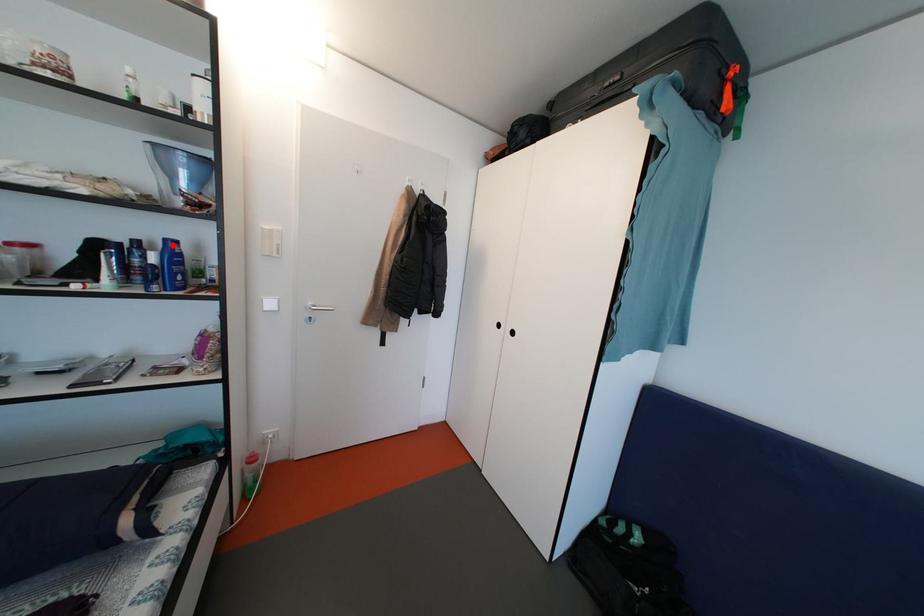
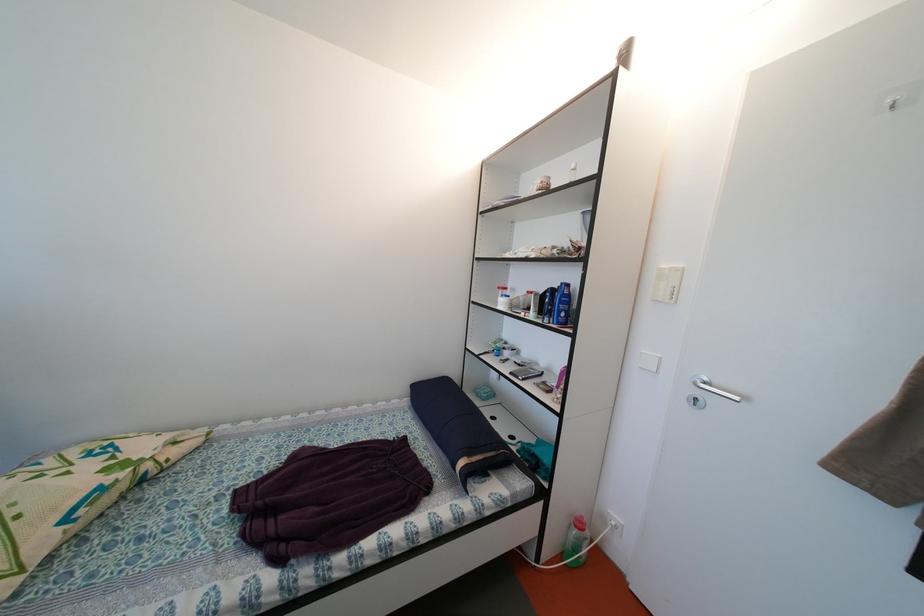
Find the pixel in the second image that matches the highlighted location in the first image.

(569, 289)